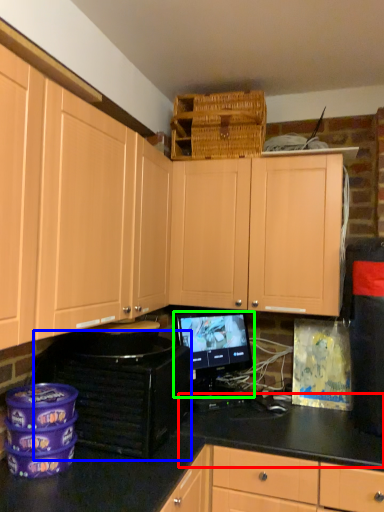
Question: Which is nearer to the counter top (highlighted by a red box)? appliance (highlighted by a blue box) or computer monitor (highlighted by a green box).

Choices:
 (A) appliance
 (B) computer monitor

Answer: (B)